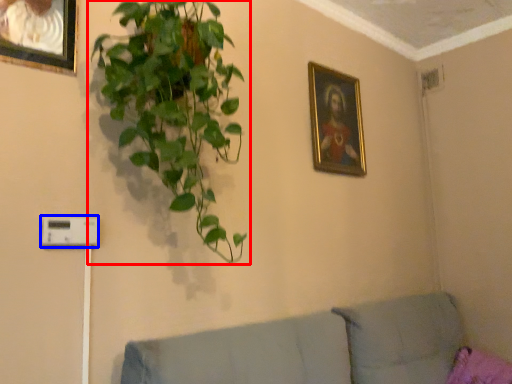
Question: Among these objects, which one is nearest to the camera, houseplant (highlighted by a red box) or light switch (highlighted by a blue box)?

Choices:
 (A) houseplant
 (B) light switch

Answer: (A)